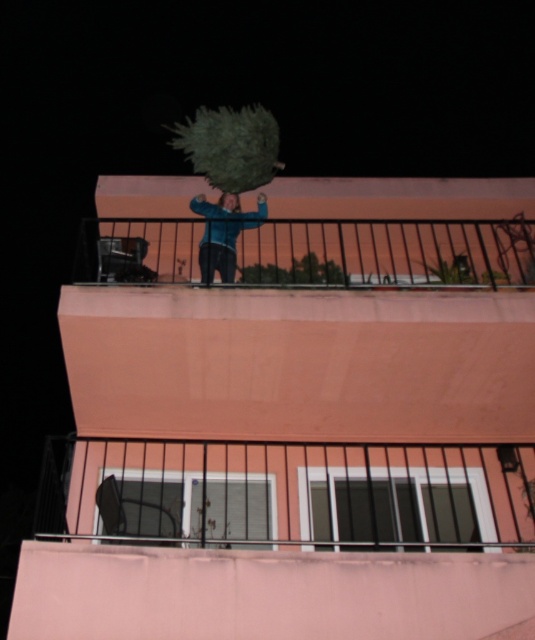
How much distance is there between metallic balcony railing at upper center and green matte tree at center?

5.12 feet

Can you confirm if metallic balcony railing at upper center is positioned to the right of green matte tree at center?

Correct, you'll find metallic balcony railing at upper center to the right of green matte tree at center.

Who is more forward, (x=166, y=230) or (x=250, y=148)?

Positioned in front is point (x=250, y=148).

Find the location of a particular element. The width and height of the screenshot is (535, 640). metallic balcony railing at upper center is located at coordinates (314, 252).

Is metallic balcony railing at upper center wider than blue denim jacket at center?

Yes, metallic balcony railing at upper center is wider than blue denim jacket at center.

Which is behind, point (418, 243) or point (216, 230)?

The point (418, 243) is behind.

Find the location of a particular element. metallic balcony railing at upper center is located at coordinates (314, 252).

Is green matte tree at center smaller than blue denim jacket at center?

Yes, green matte tree at center is smaller than blue denim jacket at center.

Is green matte tree at center thinner than blue denim jacket at center?

Incorrect, green matte tree at center's width is not less than blue denim jacket at center's.

Image resolution: width=535 pixels, height=640 pixels. Describe the element at coordinates (231, 147) in the screenshot. I see `green matte tree at center` at that location.

This screenshot has height=640, width=535. In order to click on green matte tree at center in this screenshot , I will do `click(231, 147)`.